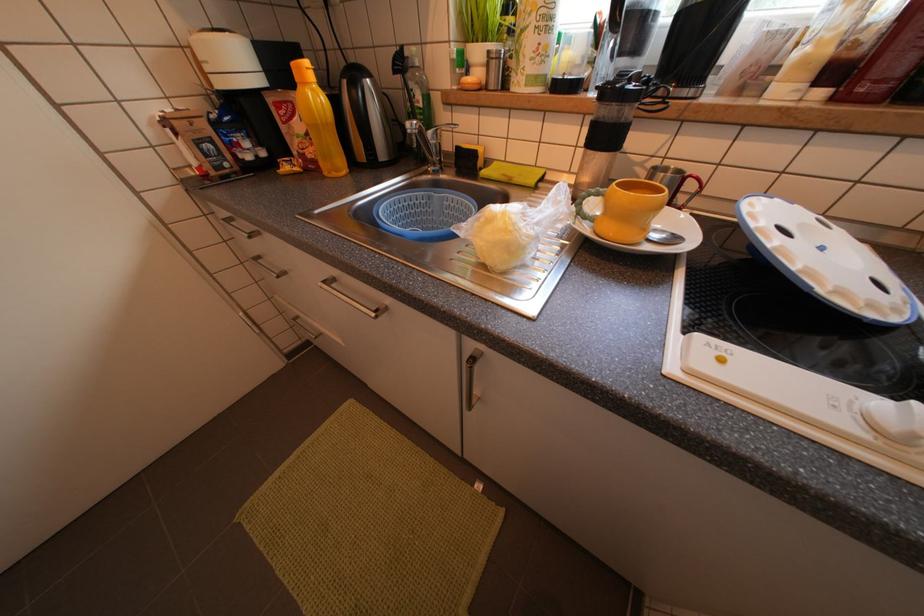
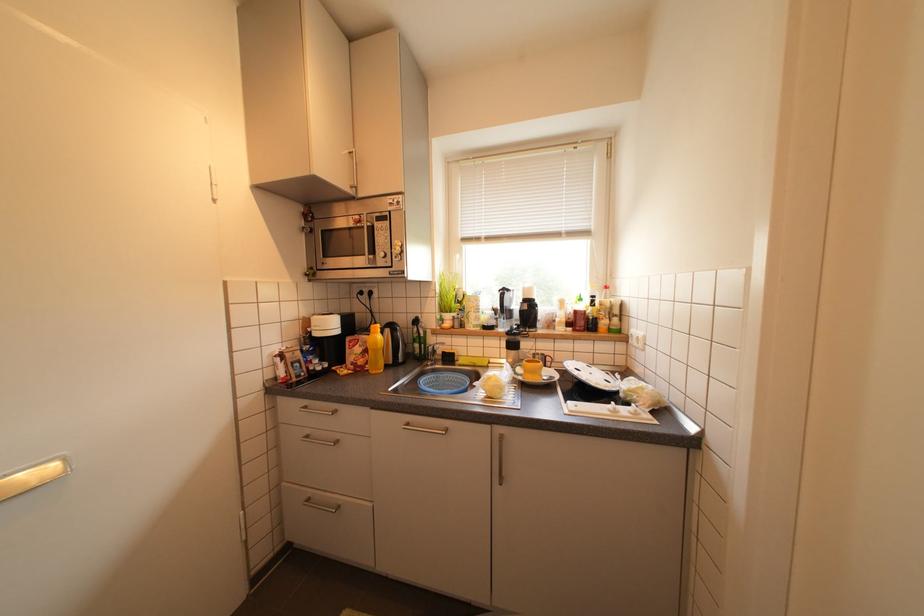
First-person continuous shooting, in which direction is the camera rotating?

The rotation direction of the camera is right-up.